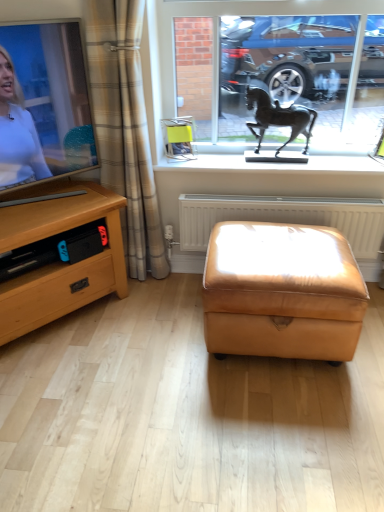
Identify the location of empty space that is to the right of wooden desk at left. (151, 324).